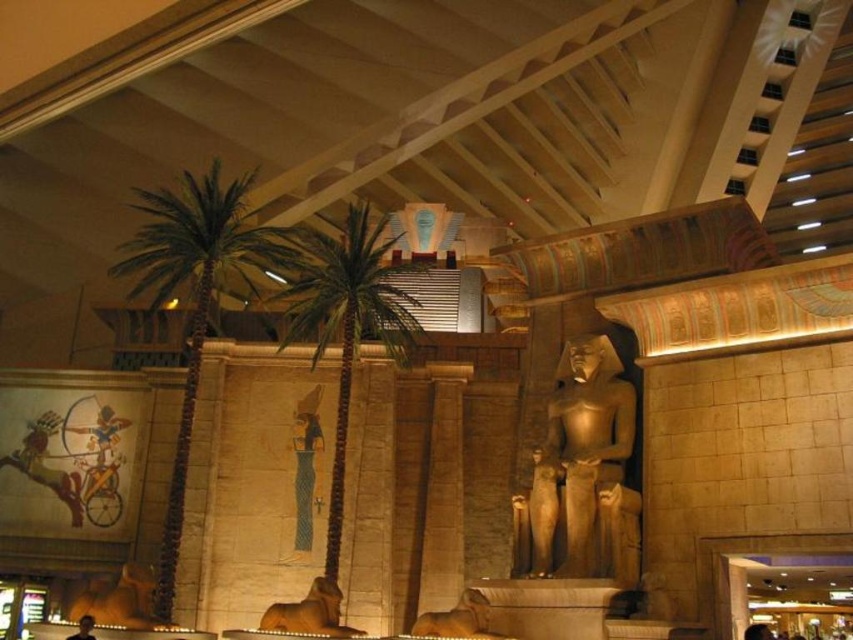
You are an interior designer planning to place a new decorative item in the space. The new item is 1 meter wide. You have to choose between placing it to the left of the gold leaf statue at center or to the right of the brown stone elephant at lower center. Which side has enough space based on the existing objects?

The gold leaf statue at center is thinner than the brown stone elephant at lower center, so placing the new item to the left of the gold leaf statue at center would have more space available compared to the right side of the brown stone elephant at lower center. Therefore, the left side of the gold leaf statue at center has enough space for the new item.

You are standing in the ancient Egyptian themed area and want to take a photo of the green leafy palm tree at center. Where should you position yourself to capture it in the frame?

The green leafy palm tree at center is located at point 0.504, so positioning yourself directly in front of it at that coordinate will ensure it is centered in your photo.

You are a tour guide leading a group through this Egyptian themed area. You want to point out both the gold leaf statue at center and the brown stone statue at lower center to your visitors. Which one is positioned farther away from the entrance of the themed area?

The brown stone statue at lower center is positioned farther away from the entrance because it is behind the gold leaf statue at center.